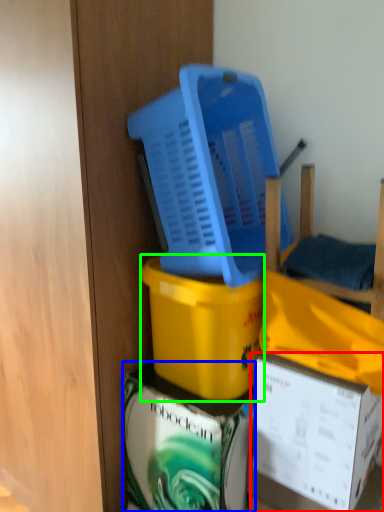
Question: Estimate the real-world distances between objects in this image. Which object is closer to box (highlighted by a red box), box (highlighted by a blue box) or box (highlighted by a green box)?

Choices:
 (A) box
 (B) box

Answer: (A)